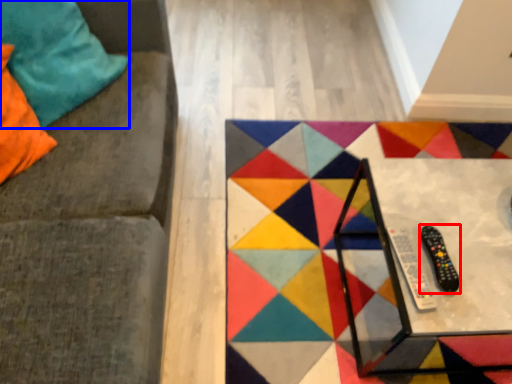
Question: Among these objects, which one is farthest to the camera, game controller (highlighted by a red box) or pillow (highlighted by a blue box)?

Choices:
 (A) game controller
 (B) pillow

Answer: (B)